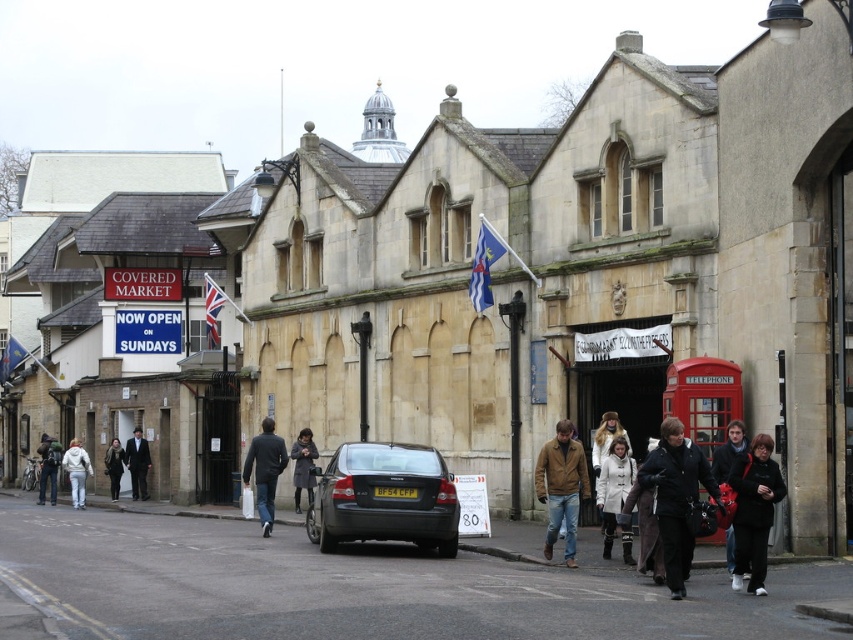
Can you confirm if white wool coat at center is bigger than dark blue jacket at center?

No, white wool coat at center is not bigger than dark blue jacket at center.

Is white wool coat at center closer to camera compared to dark blue jacket at center?

Yes, it is in front of dark blue jacket at center.

Describe the element at coordinates (614, 497) in the screenshot. This screenshot has height=640, width=853. I see `white wool coat at center` at that location.

Identify the location of white wool coat at center. (614, 497).

Does black leather jacket at lower right lie behind dark blue jacket at center?

No, black leather jacket at lower right is closer to the viewer.

Is black leather jacket at lower right below dark blue jacket at center?

Actually, black leather jacket at lower right is above dark blue jacket at center.

Who is more distant from viewer, (694, 467) or (268, 456)?

Point (268, 456)

At what (x,y) coordinates should I click in order to perform the action: click on black leather jacket at lower right. Please return your answer as a coordinate pair (x, y). Looking at the image, I should click on (675, 497).

Between dark gray metallic sedan at center and dark gray wool coat at center, which one is positioned higher?

dark gray metallic sedan at center is higher up.

Which is behind, point (427, 522) or point (309, 458)?

The point (309, 458) is behind.

This screenshot has width=853, height=640. Find the location of `dark gray metallic sedan at center`. dark gray metallic sedan at center is located at coordinates (384, 497).